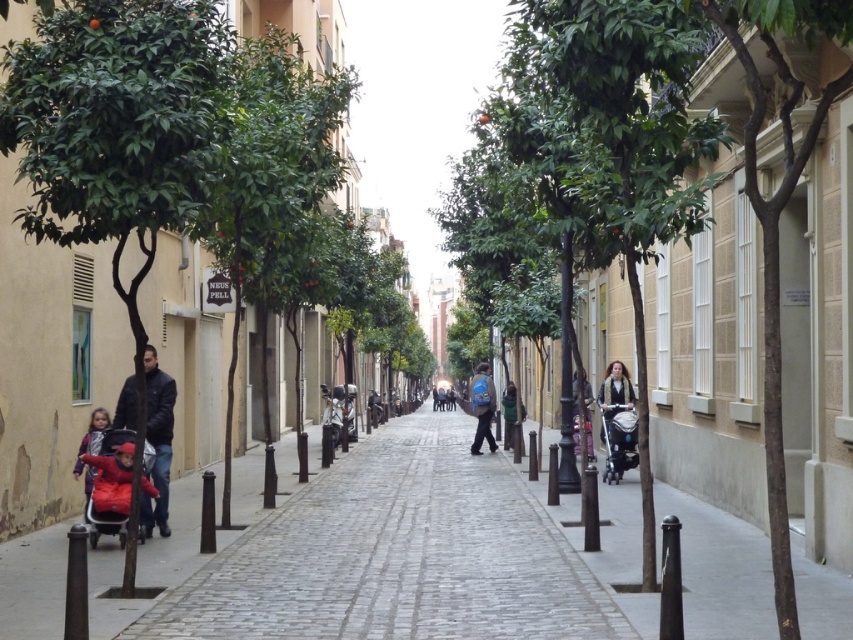
Can you confirm if cobblestone sidewalk at center is positioned to the left of blue backpack at center?

Correct, you'll find cobblestone sidewalk at center to the left of blue backpack at center.

From the picture: Is cobblestone sidewalk at center wider than blue backpack at center?

Yes.

This screenshot has width=853, height=640. What do you see at coordinates (396, 556) in the screenshot?
I see `cobblestone sidewalk at center` at bounding box center [396, 556].

Image resolution: width=853 pixels, height=640 pixels. What are the coordinates of `cobblestone sidewalk at center` in the screenshot? It's located at (396, 556).

Who is positioned more to the right, green leafy tree at center or cobblestone sidewalk at center?

green leafy tree at center

What do you see at coordinates (660, 161) in the screenshot?
I see `green leafy tree at center` at bounding box center [660, 161].

Does point (775, 356) lie behind point (363, 547)?

That is False.

Where is `green leafy tree at center`? Image resolution: width=853 pixels, height=640 pixels. green leafy tree at center is located at coordinates (660, 161).

Which of these two, cobblestone sidewalk at center or black plastic baby carriage at right, stands shorter?

With less height is cobblestone sidewalk at center.

Does cobblestone sidewalk at center have a lesser width compared to black plastic baby carriage at right?

Incorrect, cobblestone sidewalk at center's width is not less than black plastic baby carriage at right's.

This screenshot has width=853, height=640. What do you see at coordinates (396, 556) in the screenshot?
I see `cobblestone sidewalk at center` at bounding box center [396, 556].

I want to click on cobblestone sidewalk at center, so click(x=396, y=556).